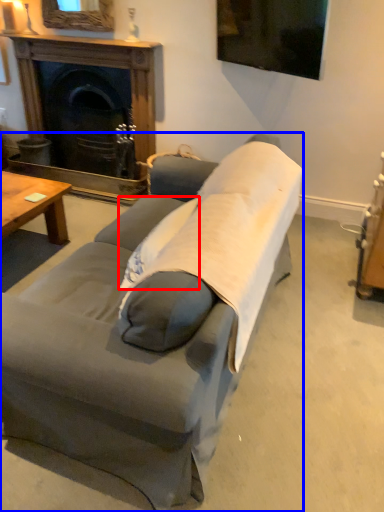
Question: Which of the following is the closest to the observer, pillow (highlighted by a red box) or studio couch (highlighted by a blue box)?

Choices:
 (A) pillow
 (B) studio couch

Answer: (B)